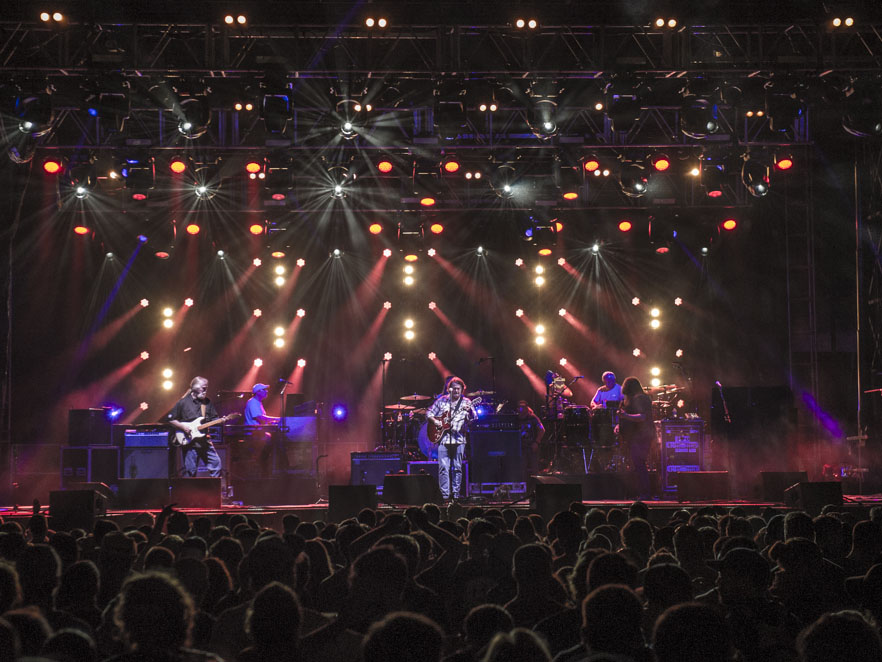
The image size is (882, 662). Find the location of `speakers`. speakers is located at coordinates (78, 506), (352, 502), (564, 498), (819, 492).